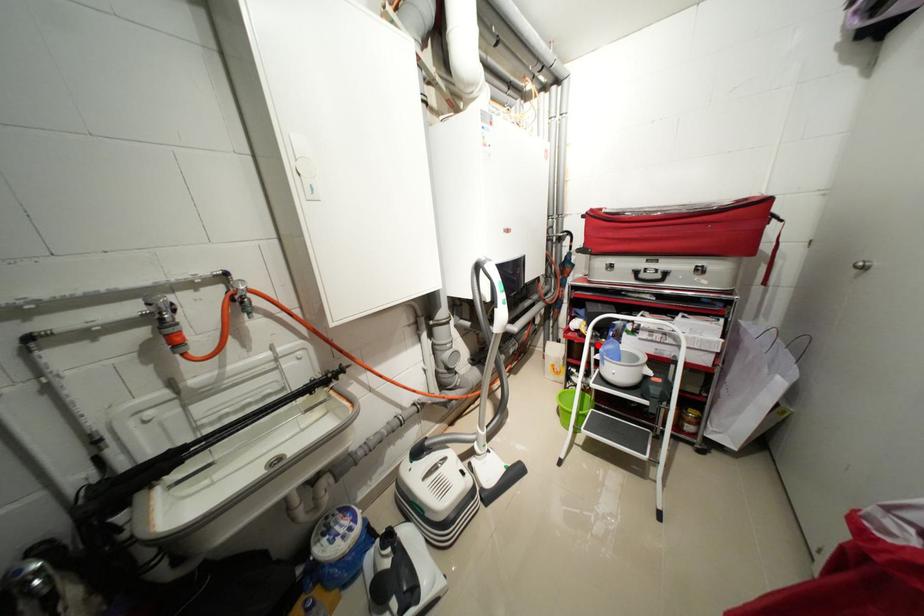
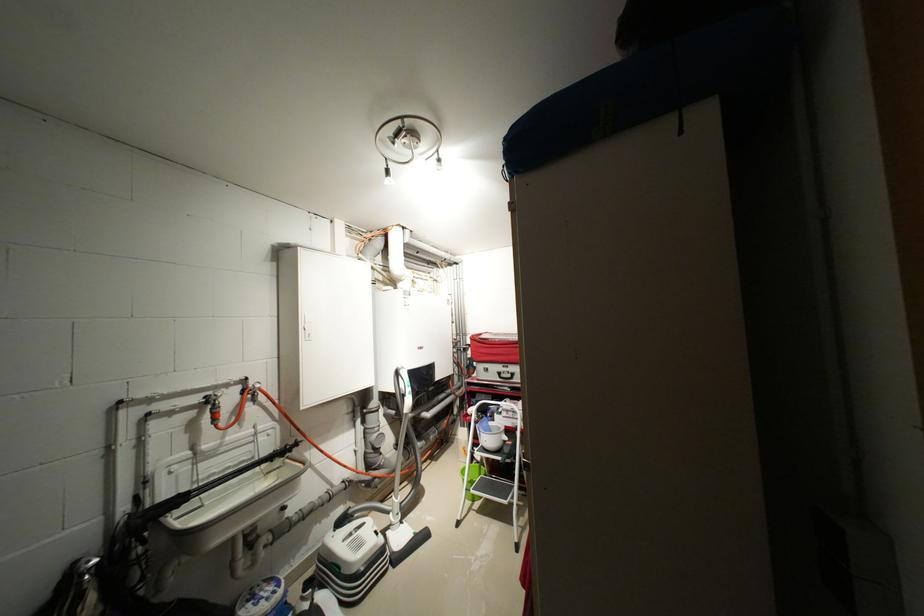
Question: I am providing you with two images of the same scene from different viewpoints. Image1 has a red point marked. In image2, the corresponding 3D location appears at what relative position? Reply with the corresponding letter.

Choices:
 (A) Closer
 (B) Farther

Answer: (B)